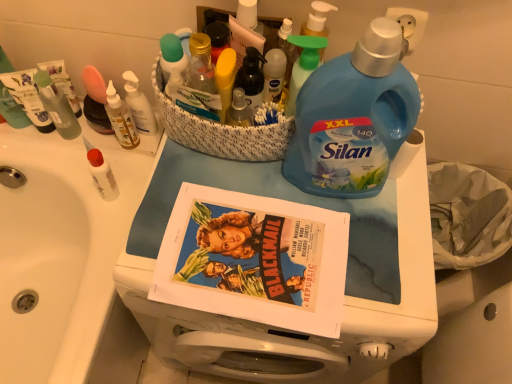
Question: Is matte paper comic book at center wider or thinner than translucent plastic bottles at upper left, which is counted as the 3th toiletry, starting from the right?

Choices:
 (A) wide
 (B) thin

Answer: (A)

Question: Considering their positions, is matte paper comic book at center located in front of or behind translucent plastic bottles at upper left, which is counted as the 3th toiletry, starting from the right?

Choices:
 (A) behind
 (B) front

Answer: (B)

Question: Which of these objects is positioned farthest from the translucent plastic bottle at center, which appears as the first bottle when viewed from the left?

Choices:
 (A) blue plastic bottle at upper right, placed as the second bottle when sorted from left to right
 (B) translucent plastic bottles at upper left, which is counted as the 3th toiletry, starting from the right
 (C) white glossy sink at upper left
 (D) blue plastic laundry detergent at center
 (E) matte paper comic book at center

Answer: (C)

Question: Which object is positioned closest to the white glossy sink at upper left?

Choices:
 (A) green plastic spray bottle at upper center
 (B) translucent plastic bottles at upper left, which is the 2th toiletry from left to right
 (C) white matte bottle at left, the 4th toiletry viewed from the right
 (D) blue plastic bottle at upper right, placed as the first bottle when sorted from right to left
 (E) matte paper comic book at center

Answer: (C)